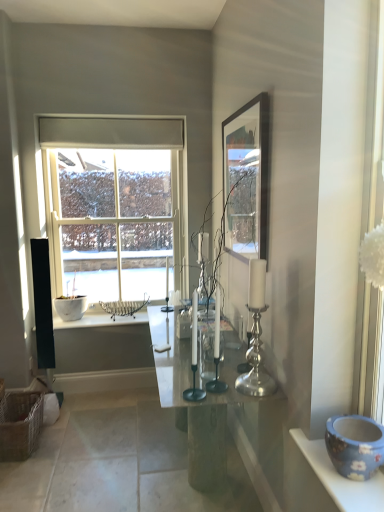
Question: Visually, is silver metallic candle holder at center, the third candle holder viewed from the right, positioned to the left or to the right of clear glass window at center?

Choices:
 (A) left
 (B) right

Answer: (B)

Question: From the image's perspective, relative to clear glass window at center, is silver metallic candle holder at center, the first candle holder from the left, above or below?

Choices:
 (A) above
 (B) below

Answer: (B)

Question: Which is farther from the polished glass table at center?

Choices:
 (A) silver metallic candle holder at center, the third candle holder viewed from the right
 (B) wooden frame at upper right
 (C) blue ceramic bowl at lower right
 (D) white glossy counter top at lower left
 (E) silver metallic candle holder at center, the second candle holder in the right-to-left sequence

Answer: (D)

Question: Which of these objects is positioned farthest from the silver metallic candle holder at center-right, acting as the third candle holder starting from the left?

Choices:
 (A) silver metallic candle holder at center, the second candle holder when ordered from left to right
 (B) wooden frame at upper right
 (C) white glossy counter top at lower left
 (D) blue ceramic bowl at lower right
 (E) polished glass table at center

Answer: (C)